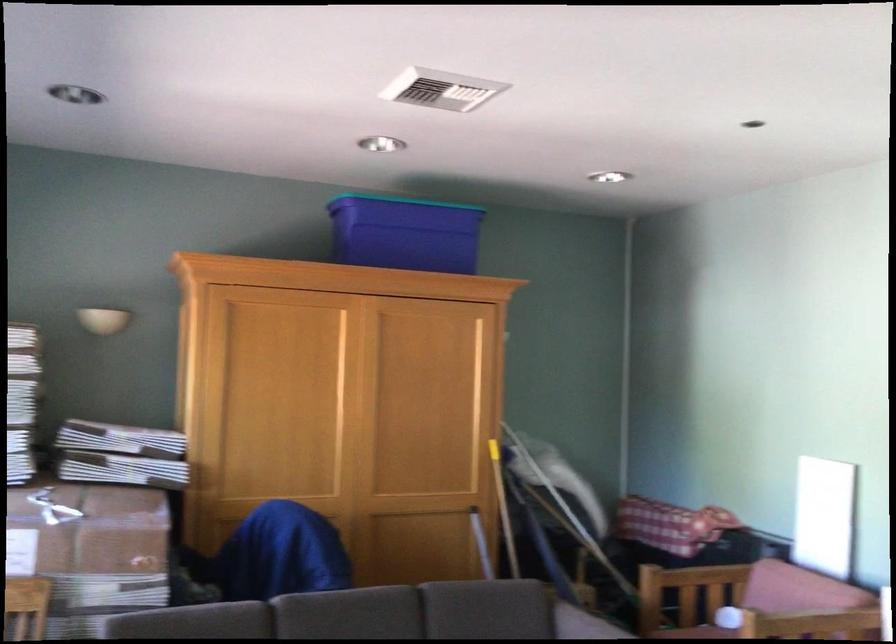
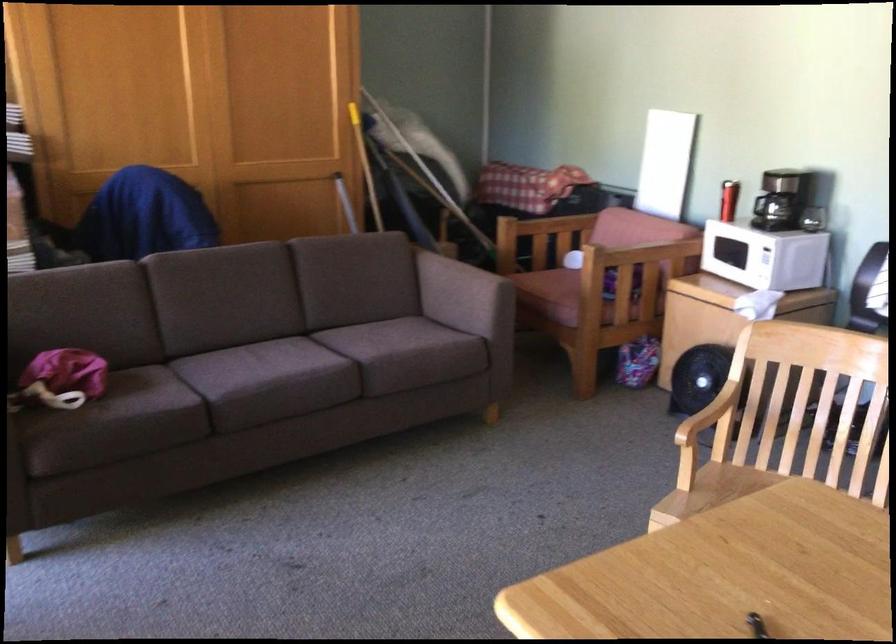
Question: Which direction would the cameraman need to move to produce the second image? Reply with the corresponding letter.

Choices:
 (A) Left
 (B) Right
 (C) Forward
 (D) Backward

Answer: (D)